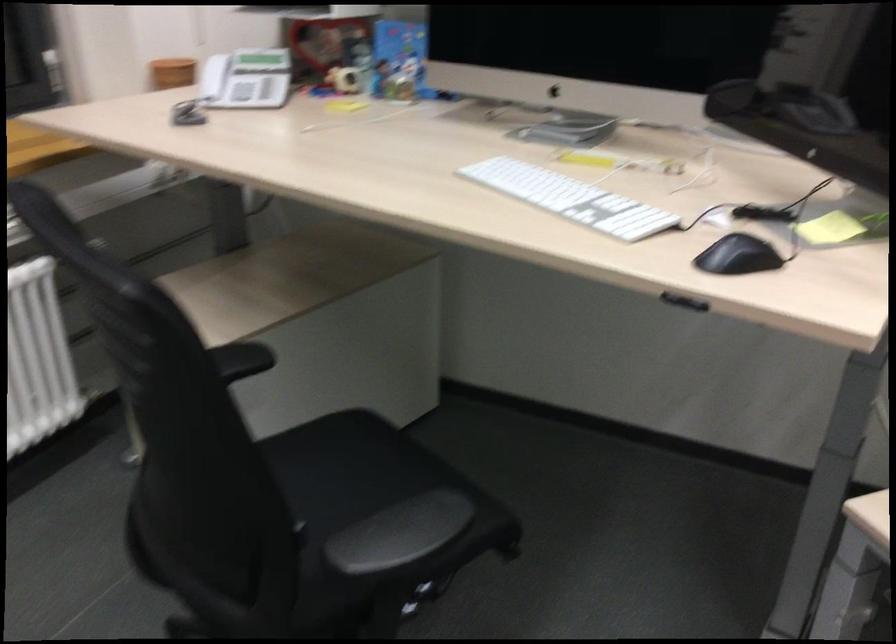
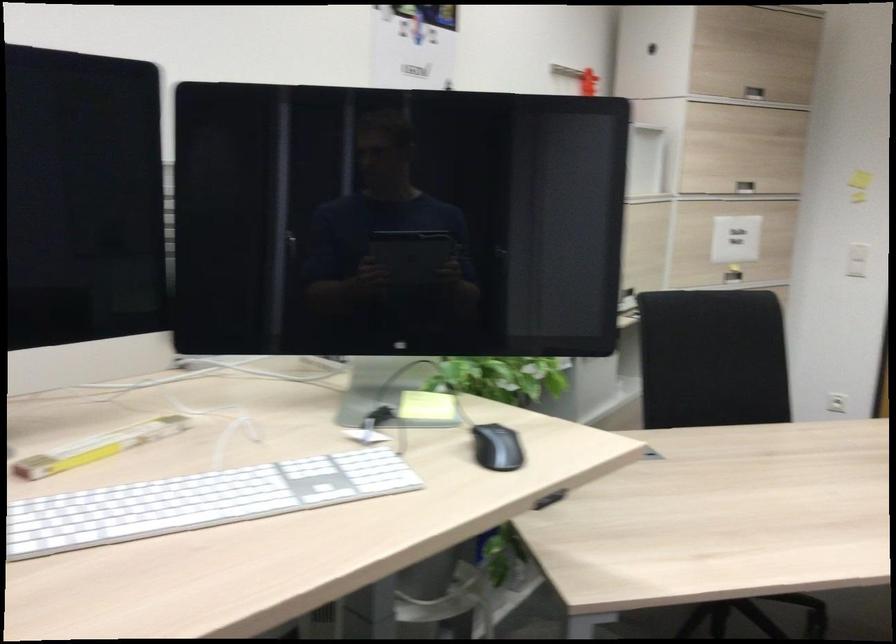
The point at (745, 256) is marked in the first image. Where is the corresponding point in the second image?

(496, 448)